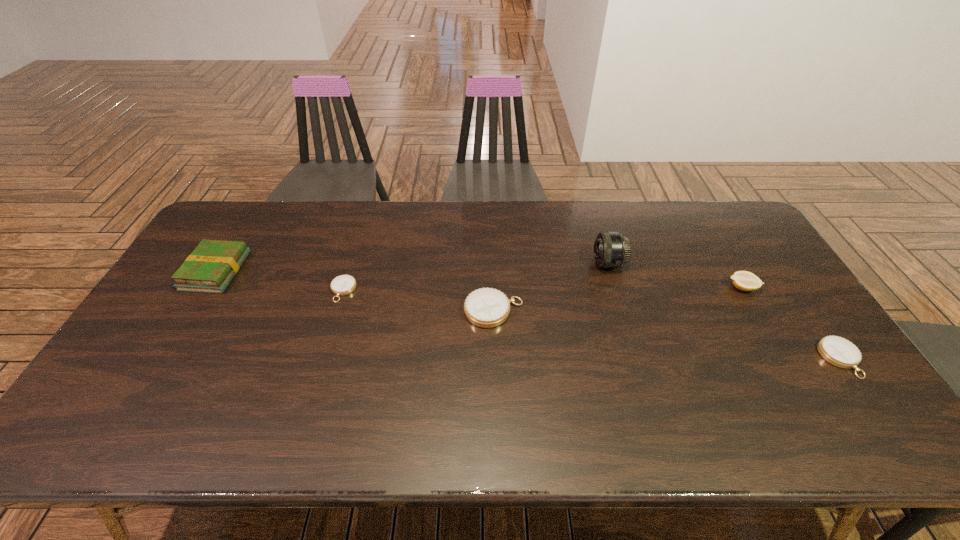
Please determine a free point for an extra compass to ensure balance. Please provide its 2D coordinates. Your answer should be formatted as a tuple, i.e. [(x, y)], where the tuple contains the x and y coordinates of a point satisfying the conditions above.

[(659, 334)]